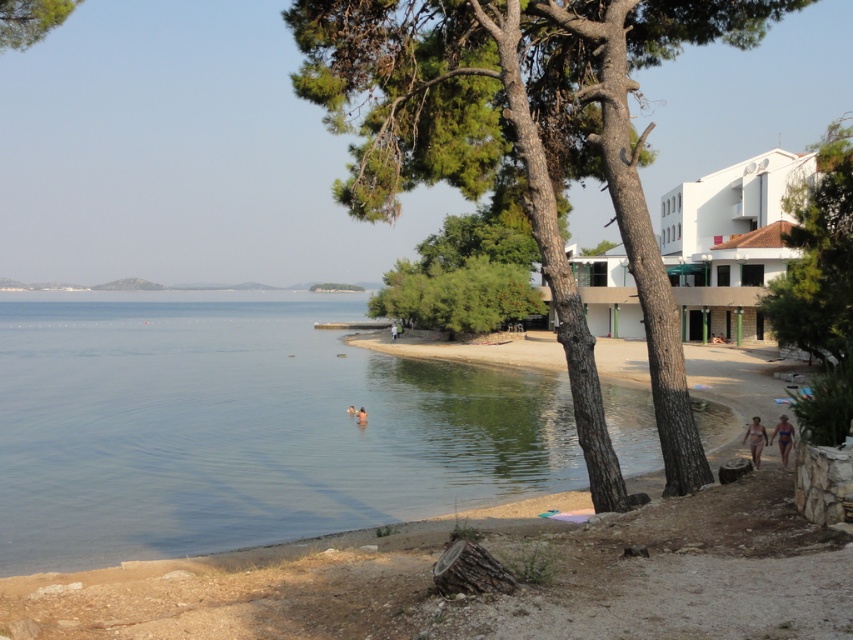
You are standing at the point labeled as point (820, 288) in the image. Looking around, what object is directly in front of you?

The point (820, 288) corresponds to the green leafy tree at right, so the green leafy tree at right is directly in front of you.

You are a photographer standing on the beach and want to capture both the green leafy tree at center and the skinny bikini swimmer at center in a single photo. Considering their sizes, which object will occupy more space in the photo?

The green leafy tree at center will occupy more space in the photo because its width is larger than that of the skinny bikini swimmer at center.